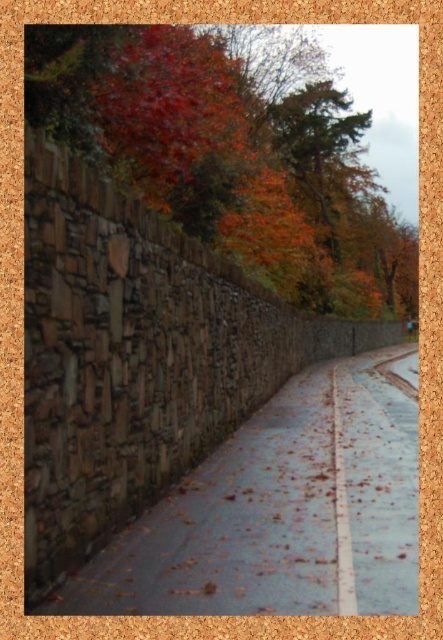
Between autumn leaves at upper center and rustic stone path at center, which one is positioned higher?

Positioned higher is autumn leaves at upper center.

Which is in front, point (202, 45) or point (261, 467)?

Point (261, 467) is more forward.

Where is `autumn leaves at upper center`? Image resolution: width=443 pixels, height=640 pixels. autumn leaves at upper center is located at coordinates (233, 150).